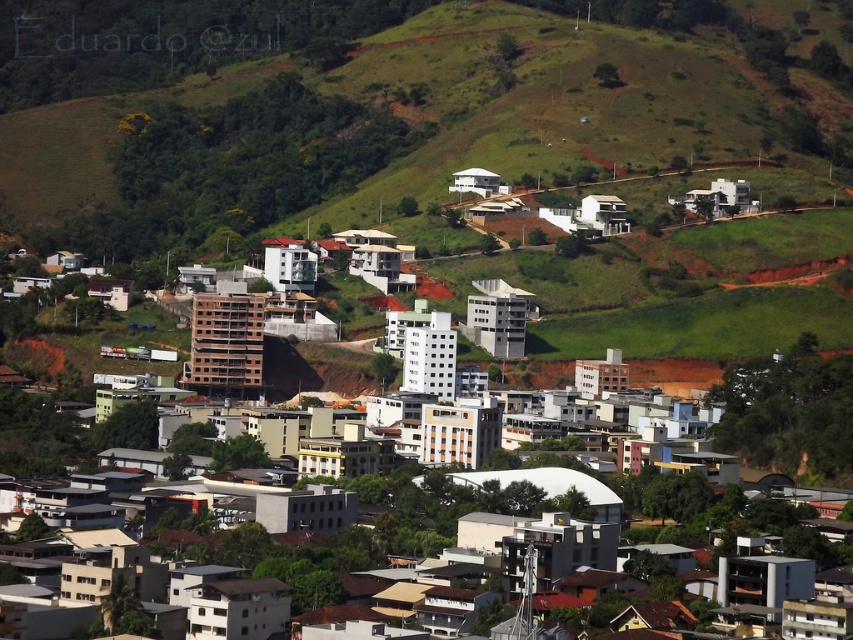
You are a city planner reviewing this area. You see the point at coordinates [399,108]. What does this point represent in the scene?

The point at coordinates [399,108] represents the green grassy hillside at upper center.

You are a drone operator tasked with capturing aerial footage of the city. Your drone has a maximum flight range of 50 meters from its takeoff point. If you launch the drone from the white matte building at center, will it be able to fly to the green grassy hillside at upper center and return without exceeding its range?

The distance between the green grassy hillside at upper center and the white matte building at center is 46.78 meters. Since the drone needs to fly to the hillside and return, the round trip distance would be 93.56 meters. However, the drone can only travel 50 meters from its takeoff point. Therefore, the drone cannot reach the hillside and return within its maximum range.

You are a city planner reviewing this area. You need to determine if the green grassy hillside at upper center is positioned higher than the white matte building at center. Based on the image, what can you conclude?

The green grassy hillside at upper center is located above the white matte building at center, so it is positioned higher than the building.